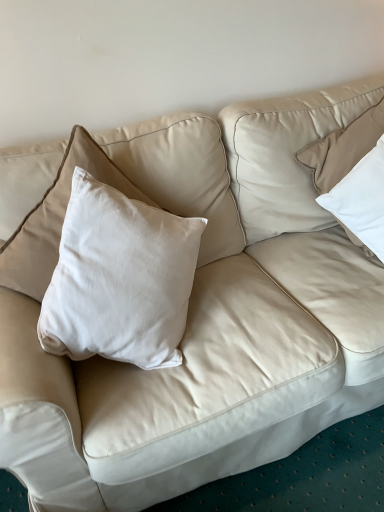
Image resolution: width=384 pixels, height=512 pixels. Find the location of `white soft pillow at upper right`. white soft pillow at upper right is located at coordinates (342, 148).

This screenshot has width=384, height=512. What do you see at coordinates (342, 148) in the screenshot? I see `white soft pillow at upper right` at bounding box center [342, 148].

The width and height of the screenshot is (384, 512). In order to click on white soft pillow at upper right in this screenshot , I will do `click(342, 148)`.